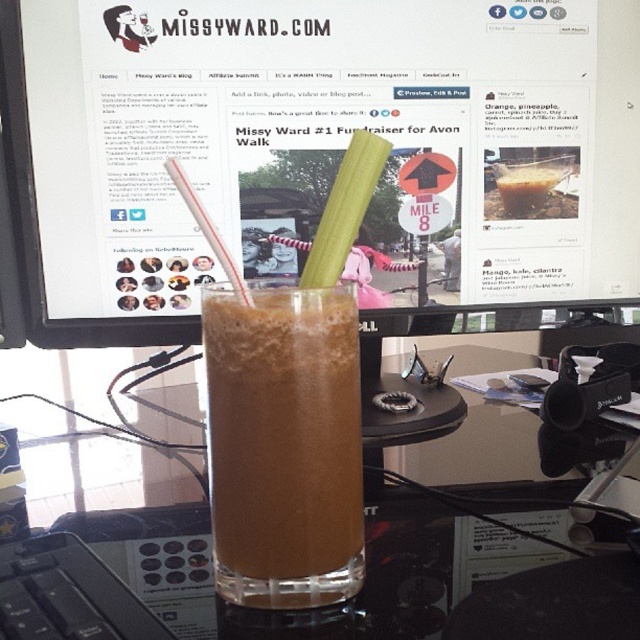
You are organizing a picnic and have a translucent plastic cup at center and a brown frothy drink at center. If you want to pour the drink into the cup without spilling, will the cup be wide enough to hold the drink?

The translucent plastic cup at center has a larger width than the brown frothy drink at center, so the cup will be wide enough to hold the drink without spilling.

You are organizing a desk for a charity event and need to place a document on the desk. The document must be placed to the left of the translucent plastic cup at center. Can you place it to the left of the matte plastic computer monitor at center?

The matte plastic computer monitor at center is positioned on the right side of the translucent plastic cup at center, so placing the document to the left of the matte plastic computer monitor at center would also be to the left of the translucent plastic cup at center. Yes, you can place it there.

What are the coordinates of the matte plastic computer monitor at center?

The matte plastic computer monitor at center is located at coordinates point (317, 150).